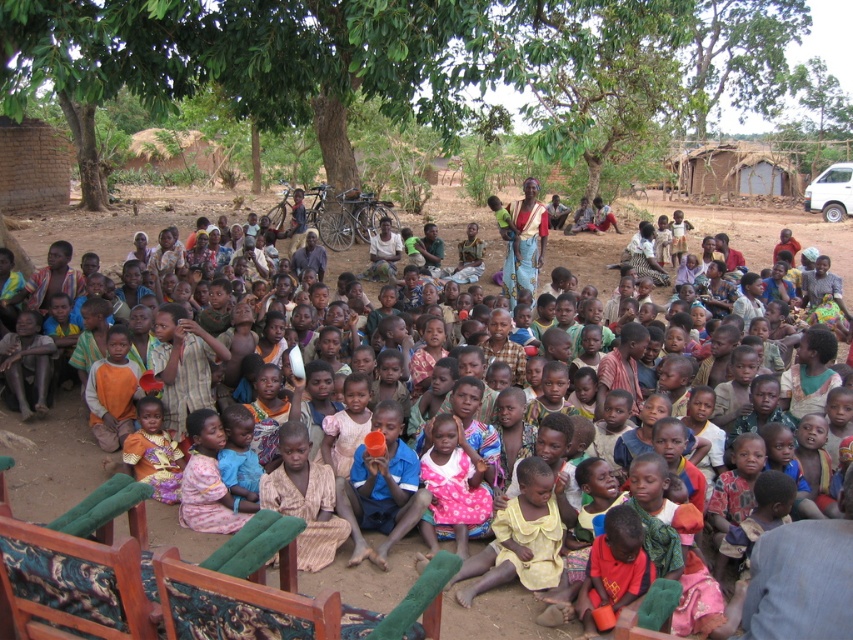
Who is taller, green leafy tree at center or multicolored fabric dress at center?

green leafy tree at center

Which is more to the right, green leafy tree at center or multicolored fabric dress at center?

Positioned to the right is multicolored fabric dress at center.

Locate an element on the screen. This screenshot has height=640, width=853. green leafy tree at center is located at coordinates (397, 61).

Find the location of `green leafy tree at center`. green leafy tree at center is located at coordinates (397, 61).